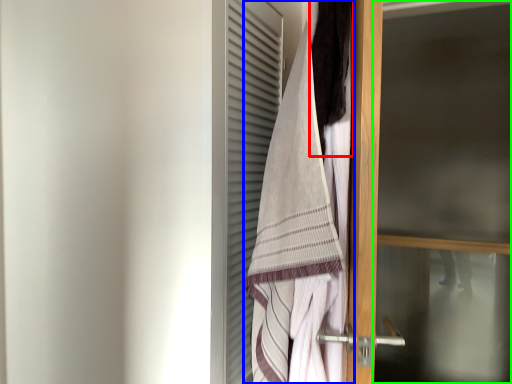
Question: Which object is positioned closest to hair (highlighted by a red box)? Select from towel (highlighted by a blue box) and screen door (highlighted by a green box).

Choices:
 (A) towel
 (B) screen door

Answer: (A)